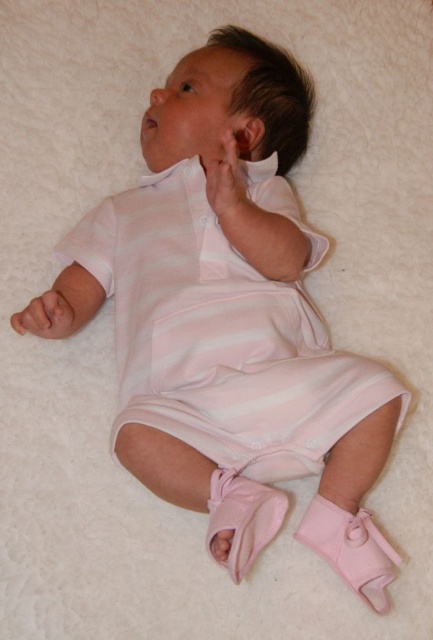
Question: Does pink fabric hand at upper center have a smaller size compared to pink soft fabric hand at upper left?

Choices:
 (A) yes
 (B) no

Answer: (B)

Question: Does pink fabric hand at upper center have a larger size compared to pink soft fabric hand at upper left?

Choices:
 (A) no
 (B) yes

Answer: (B)

Question: Can you confirm if pink fabric hand at upper center is wider than pink soft fabric hand at upper left?

Choices:
 (A) yes
 (B) no

Answer: (B)